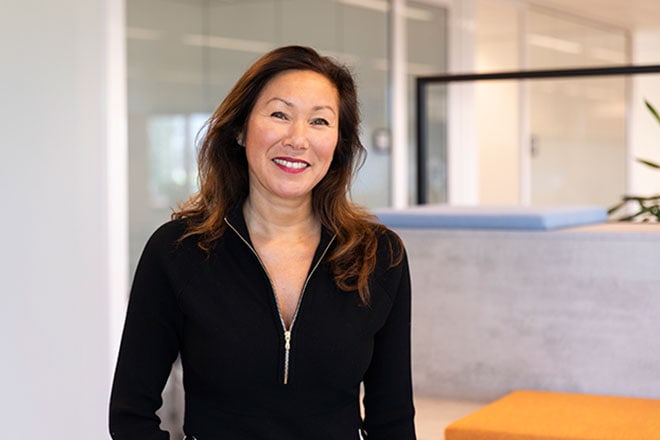
Identify the location of orange counter/table. (538, 423).